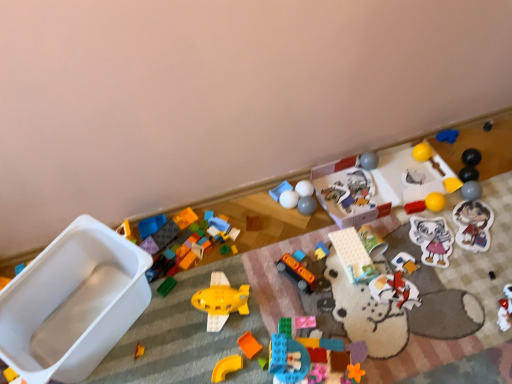
The width and height of the screenshot is (512, 384). I want to click on vacant space behind white glossy sticker at center-right, which is counted as the sixth toy, starting from the right, so click(x=420, y=209).